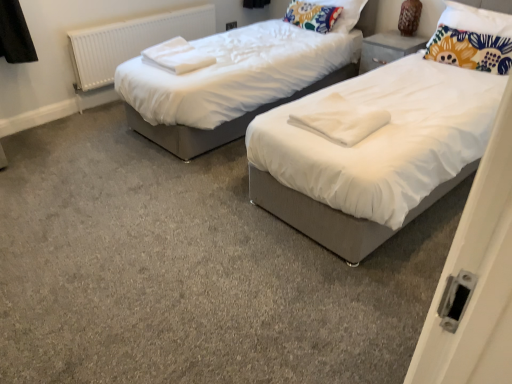
Question: Should I look upward or downward to see floral fabric pillow at upper center, acting as the first pillow starting from the left?

Choices:
 (A) down
 (B) up

Answer: (B)

Question: Does white soft towel at center, the 1th linen viewed from the front, lie in front of white soft towels at upper left, the 2th linen in the bottom-to-top sequence?

Choices:
 (A) no
 (B) yes

Answer: (B)

Question: Considering the relative sizes of white soft towel at center, acting as the 2th linen starting from the top, and white soft towels at upper left, which is the 1th linen in left-to-right order, in the image provided, is white soft towel at center, acting as the 2th linen starting from the top, wider than white soft towels at upper left, which is the 1th linen in left-to-right order,?

Choices:
 (A) no
 (B) yes

Answer: (B)

Question: Does white soft towel at center, which ranks as the second linen in back-to-front order, have a larger size compared to white soft towels at upper left, which is the 1th linen in left-to-right order?

Choices:
 (A) yes
 (B) no

Answer: (B)

Question: Considering the relative sizes of white soft towel at center, which is counted as the 2th linen, starting from the left, and white soft towels at upper left, the 2th linen viewed from the right, in the image provided, is white soft towel at center, which is counted as the 2th linen, starting from the left, thinner than white soft towels at upper left, the 2th linen viewed from the right,?

Choices:
 (A) yes
 (B) no

Answer: (B)

Question: Could you tell me if white soft towel at center, marked as the 1th linen in a right-to-left arrangement, is facing white soft towels at upper left, which is the 1th linen in left-to-right order?

Choices:
 (A) no
 (B) yes

Answer: (A)

Question: Does white soft towel at center, the 1th linen viewed from the front, have a smaller size compared to white soft towels at upper left, the 1th linen in the back-to-front sequence?

Choices:
 (A) yes
 (B) no

Answer: (A)

Question: Is white soft towel at center, which is counted as the 1th linen, starting from the bottom, wider than white plastic radiator at left?

Choices:
 (A) no
 (B) yes

Answer: (B)

Question: Is white soft towel at center, acting as the 2th linen starting from the top, next to white plastic radiator at left?

Choices:
 (A) yes
 (B) no

Answer: (B)

Question: Considering the relative positions of white soft towel at center, which ranks as the second linen in back-to-front order, and white plastic radiator at left in the image provided, is white soft towel at center, which ranks as the second linen in back-to-front order, to the left of white plastic radiator at left from the viewer's perspective?

Choices:
 (A) no
 (B) yes

Answer: (A)

Question: Does white soft towel at center, the 1th linen viewed from the front, come behind white plastic radiator at left?

Choices:
 (A) no
 (B) yes

Answer: (A)

Question: From a real-world perspective, is white soft towel at center, which ranks as the second linen in back-to-front order, under white plastic radiator at left?

Choices:
 (A) yes
 (B) no

Answer: (B)

Question: From a real-world perspective, is white soft towel at center, which is counted as the 1th linen, starting from the bottom, on white plastic radiator at left?

Choices:
 (A) no
 (B) yes

Answer: (B)

Question: Is floral fabric pillow at upper right, positioned as the first pillow in front-to-back order, located within white soft towel at center, the 1th linen viewed from the front?

Choices:
 (A) yes
 (B) no

Answer: (B)